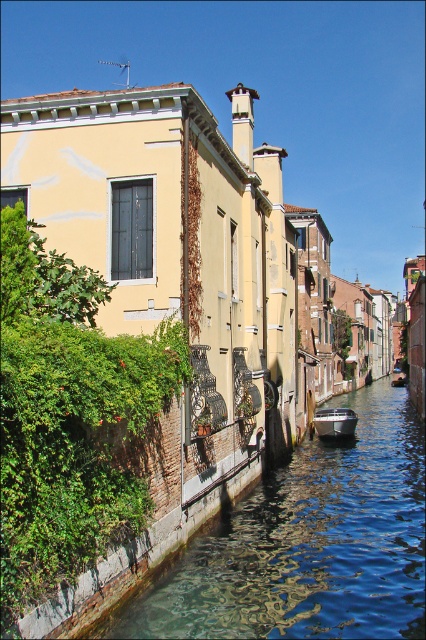
Based on the photo, you are standing on a bridge overlooking the smooth concrete canal at center and the metallic gray boat at lower center. Which object is closer to your left side?

The smooth concrete canal at center is closer to your left side as it is positioned to the left of the metallic gray boat at lower center.

You are standing on a bridge overlooking the smooth concrete canal at center and the metallic gray boat at lower center. From your vantage point, which object appears closer to you?

The metallic gray boat at lower center appears closer because it is positioned above the smooth concrete canal at center, which is located below it.